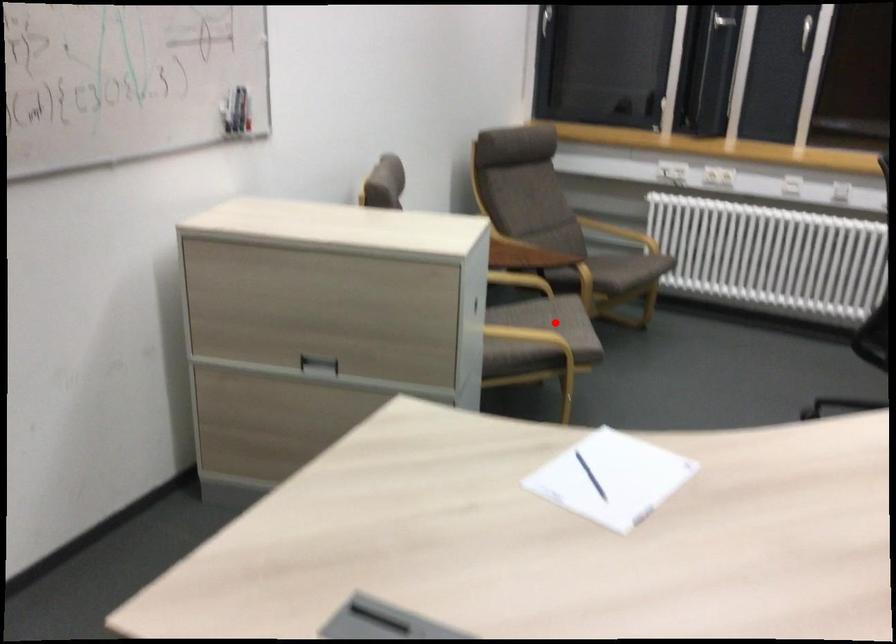
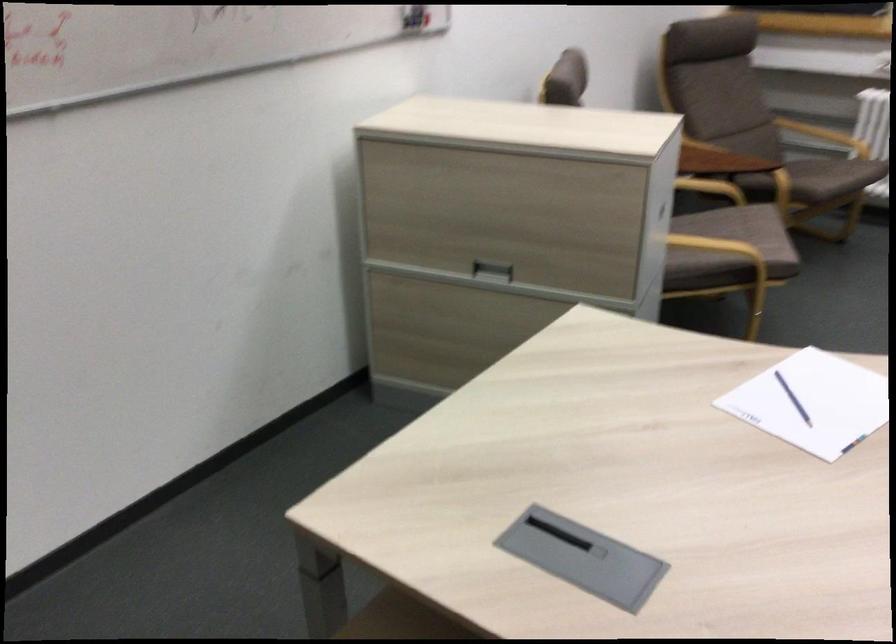
Question: I am providing you with two images of the same scene from different viewpoints. A red point is marked on the first image. At the location where the point appears in image 1, is it still visible in image 2?

Choices:
 (A) Yes
 (B) No

Answer: (A)